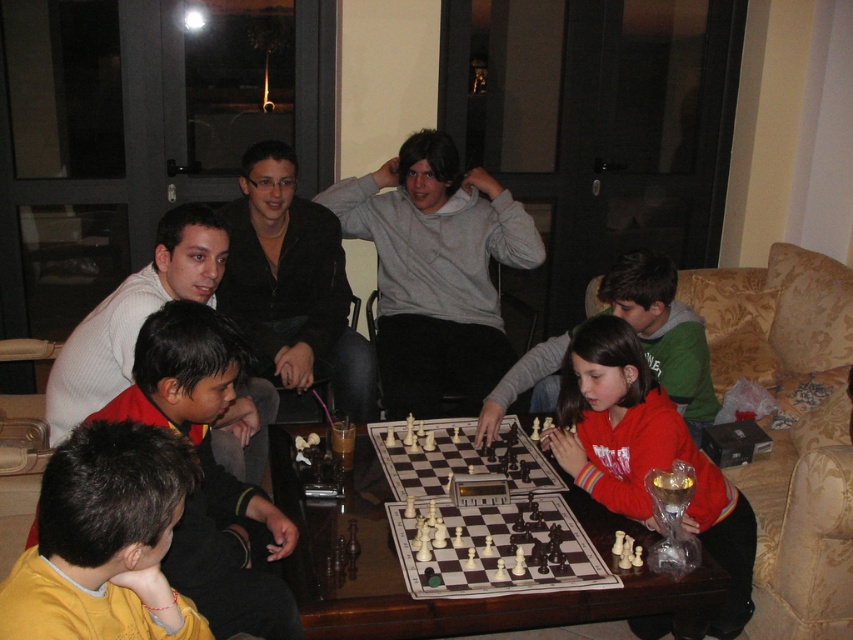
You are a photographer standing in the living room and want to take a photo of the dark brown hair at lower left and the white wooden chess set at center. Which object should you focus on first if you want to capture both in sharp focus?

The dark brown hair at lower left has a greater height compared to the white wooden chess set at center, so you should focus on the taller dark brown hair at lower left first to ensure both are in sharp focus.

You are a photographer standing in the living room and want to take a photo of the white wooden chess set at center without the dark brown hair at lower left blocking it. What should you do?

The dark brown hair at lower left is in front of the white wooden chess set at center, so you should move the dark brown hair at lower left out of the way or adjust your angle to avoid the obstruction.